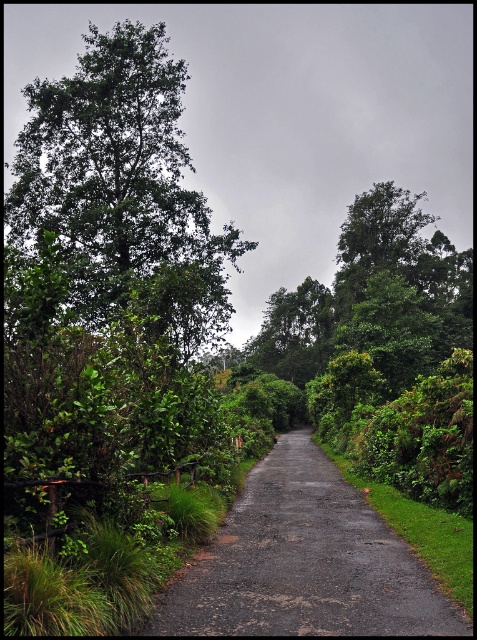
Is point (132, 170) closer to viewer compared to point (313, 528)?

No, it is behind (313, 528).

In the scene shown: Can you confirm if green leafy tree at left is smaller than dark gray asphalt road at center?

No.

Describe the element at coordinates (123, 189) in the screenshot. I see `green leafy tree at left` at that location.

Where is `green leafy tree at left`? Image resolution: width=477 pixels, height=640 pixels. green leafy tree at left is located at coordinates (123, 189).